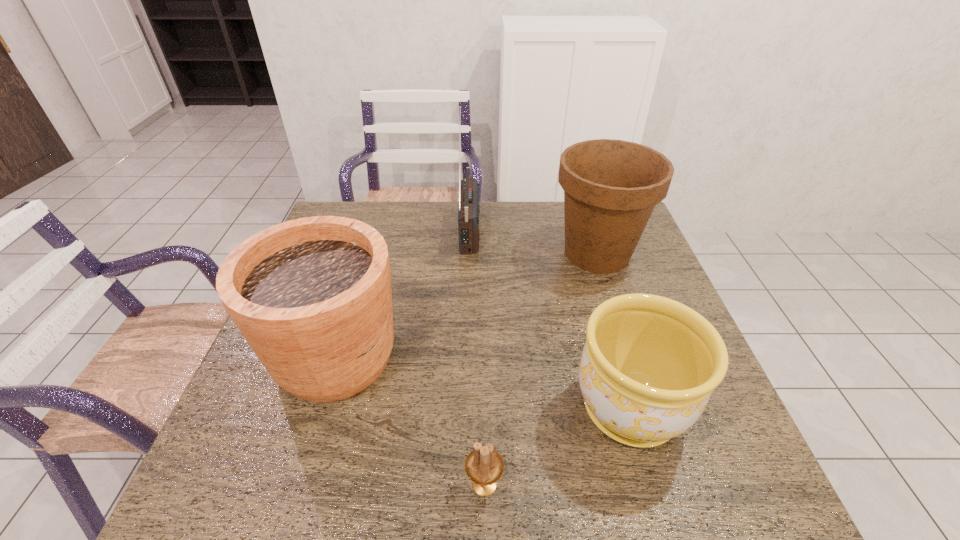
Locate an element on the screen. The height and width of the screenshot is (540, 960). vacant space that satisfies the following two spatial constraints: 1. on the back side of the nearest object; 2. on the left side of the second shortest object is located at coordinates (484, 409).

At what (x,y) coordinates should I click in order to perform the action: click on vacant space that satisfies the following two spatial constraints: 1. on the back side of the shortest flowerpot; 2. on the right side of the candle holder. Please return your answer as a coordinate pair (x, y). This screenshot has height=540, width=960. Looking at the image, I should click on (484, 409).

You are a GUI agent. You are given a task and a screenshot of the screen. Output one action in this format:
    pyautogui.click(x=<x>, y=<y>)
    Task: Click on the blank space that satisfies the following two spatial constraints: 1. on the front side of the nearest object; 2. on the right side of the leftmost object
    
    Given the screenshot: What is the action you would take?
    pyautogui.click(x=296, y=485)

Where is `free spot that satisfies the following two spatial constraints: 1. on the front side of the shortest object; 2. on the right side of the leftmost flowerpot`? free spot that satisfies the following two spatial constraints: 1. on the front side of the shortest object; 2. on the right side of the leftmost flowerpot is located at coordinates (296, 485).

Locate an element on the screen. vacant space that satisfies the following two spatial constraints: 1. on the back side of the leftmost object; 2. on the left side of the farthest flowerpot is located at coordinates (368, 253).